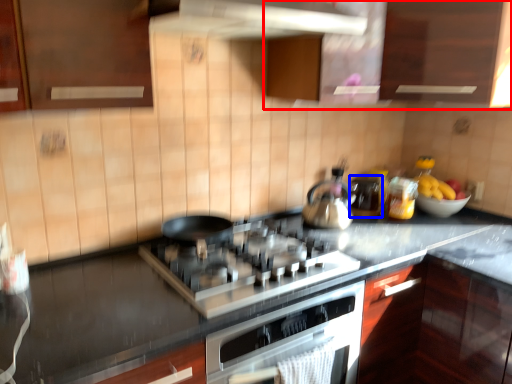
Question: Which of the following is the closest to the observer, cabinetry (highlighted by a red box) or appliance (highlighted by a blue box)?

Choices:
 (A) cabinetry
 (B) appliance

Answer: (A)